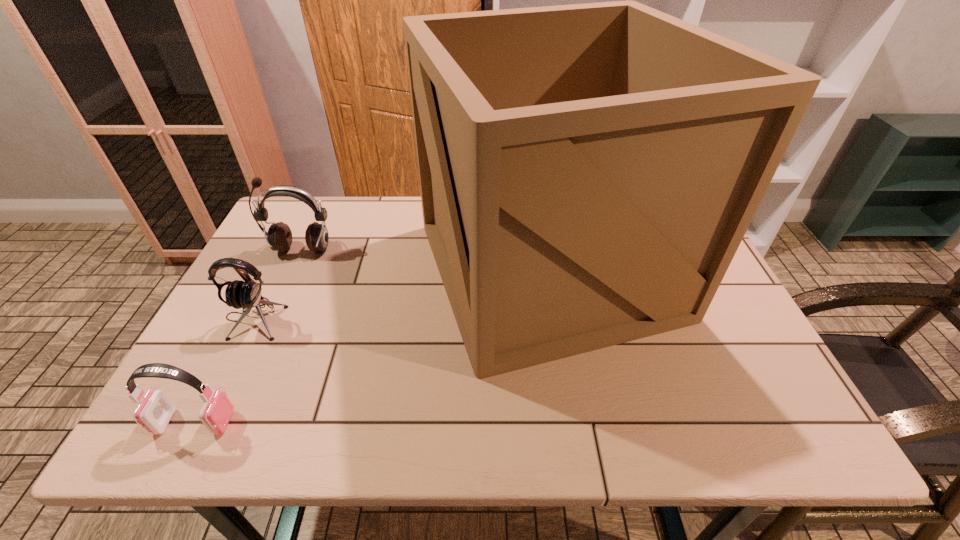
Find the location of a particular element. Image resolution: width=960 pixels, height=540 pixels. earphone that is at the far edge is located at coordinates 279,236.

This screenshot has width=960, height=540. I want to click on object that is at the near edge, so click(x=155, y=412).

Where is `object that is at the right edge`? object that is at the right edge is located at coordinates (587, 172).

What are the coordinates of `object that is at the far left corner` in the screenshot? It's located at [279, 236].

This screenshot has height=540, width=960. Identify the location of object present at the near left corner. (155, 412).

Where is `object situated at the far right corner`? The image size is (960, 540). object situated at the far right corner is located at coordinates (587, 172).

In the image, there is a desktop. What are the coordinates of `free region at the far edge` in the screenshot? It's located at (410, 206).

Identify the location of free location at the near edge. (493, 430).

What are the coordinates of `vacant region at the left edge of the desktop` in the screenshot? It's located at (276, 306).

This screenshot has width=960, height=540. I want to click on free space at the right edge of the desktop, so click(717, 383).